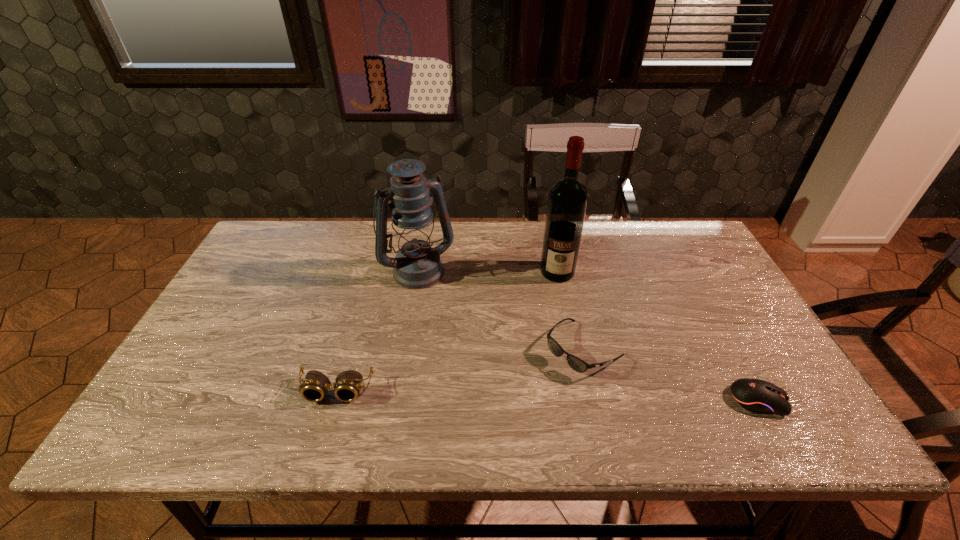
At what (x,y) coordinates should I click in order to perform the action: click on free space located 0.090m on the front-facing side of the sunglasses. Please return your answer as a coordinate pair (x, y). The height and width of the screenshot is (540, 960). Looking at the image, I should click on pos(533,392).

Find the location of a particular element. vacant space located 0.130m on the front-facing side of the sunglasses is located at coordinates (520, 402).

Identify the location of vacant space located on the front and back of the alcohol. The image size is (960, 540). tap(555, 386).

You are a GUI agent. You are given a task and a screenshot of the screen. Output one action in this format:
    pyautogui.click(x=<x>, y=<y>)
    Task: Click on the free space located 0.090m on the front and back of the alcohol
    This screenshot has width=960, height=540.
    Given the screenshot: What is the action you would take?
    pyautogui.click(x=557, y=305)

You are a GUI agent. You are given a task and a screenshot of the screen. Output one action in this format:
    pyautogui.click(x=<x>, y=<y>)
    Task: Click on the vacant space located on the front and back of the alcohol
    
    Given the screenshot: What is the action you would take?
    pyautogui.click(x=556, y=359)

This screenshot has height=540, width=960. What are the coordinates of `lantern located in the far edge section of the desktop` in the screenshot? It's located at (417, 265).

Where is `alcohol at the far edge`? The height and width of the screenshot is (540, 960). alcohol at the far edge is located at coordinates (567, 201).

Identify the location of goggles present at the near edge. (315, 387).

Where is `computer mouse that is at the near edge`? computer mouse that is at the near edge is located at coordinates (758, 396).

The width and height of the screenshot is (960, 540). In order to click on sunglasses present at the near edge in this screenshot , I will do `click(575, 363)`.